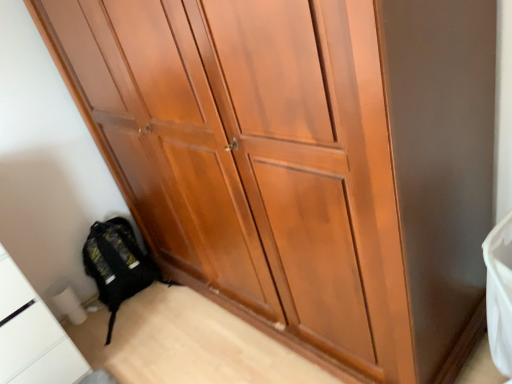
Question: In terms of width, does white glossy cabinet at lower left look wider or thinner when compared to black fabric backpack at lower left?

Choices:
 (A) thin
 (B) wide

Answer: (B)

Question: Is white glossy cabinet at lower left to the left or to the right of black fabric backpack at lower left in the image?

Choices:
 (A) right
 (B) left

Answer: (B)

Question: From a real-world perspective, relative to black fabric backpack at lower left, is white glossy cabinet at lower left vertically above or below?

Choices:
 (A) above
 (B) below

Answer: (A)

Question: Is black fabric backpack at lower left inside or outside of white glossy cabinet at lower left?

Choices:
 (A) inside
 (B) outside

Answer: (B)

Question: Considering the positions of point (119, 244) and point (19, 311), is point (119, 244) closer or farther from the camera than point (19, 311)?

Choices:
 (A) farther
 (B) closer

Answer: (A)

Question: From a real-world perspective, is black fabric backpack at lower left above or below white glossy cabinet at lower left?

Choices:
 (A) above
 (B) below

Answer: (B)

Question: Is black fabric backpack at lower left bigger or smaller than white glossy cabinet at lower left?

Choices:
 (A) small
 (B) big

Answer: (A)